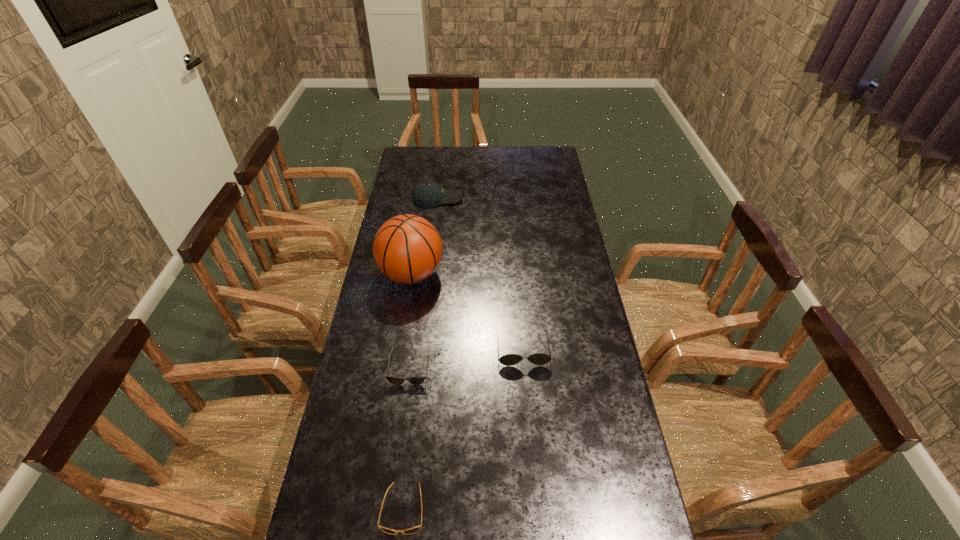
Where is `basketball that is at the left edge`? The width and height of the screenshot is (960, 540). basketball that is at the left edge is located at coordinates (407, 248).

Locate an element on the screen. baseball cap that is at the left edge is located at coordinates (428, 194).

The height and width of the screenshot is (540, 960). I want to click on vacant area at the far edge, so click(508, 164).

Where is `vacant area at the left edge`? Image resolution: width=960 pixels, height=540 pixels. vacant area at the left edge is located at coordinates tap(358, 351).

This screenshot has width=960, height=540. I want to click on blank area at the right edge, so click(x=545, y=231).

At what (x,y) coordinates should I click in order to perform the action: click on empty location between the rightmost sunglasses and the farthest object. Please return your answer as a coordinate pair (x, y). This screenshot has width=960, height=540. Looking at the image, I should click on (480, 274).

I want to click on vacant area that lies between the third shortest object and the second tallest object, so click(x=480, y=274).

Identify the location of free point between the second tallest object and the nearest object. (420, 353).

Point out which object is positioned as the second nearest to the farthest object. Please provide its 2D coordinates. Your answer should be formatted as a tuple, i.e. [(x, y)], where the tuple contains the x and y coordinates of a point satisfying the conditions above.

[(510, 359)]

Identify which object is located as the nearest to the second tallest object. Please provide its 2D coordinates. Your answer should be formatted as a tuple, i.e. [(x, y)], where the tuple contains the x and y coordinates of a point satisfying the conditions above.

[(407, 248)]